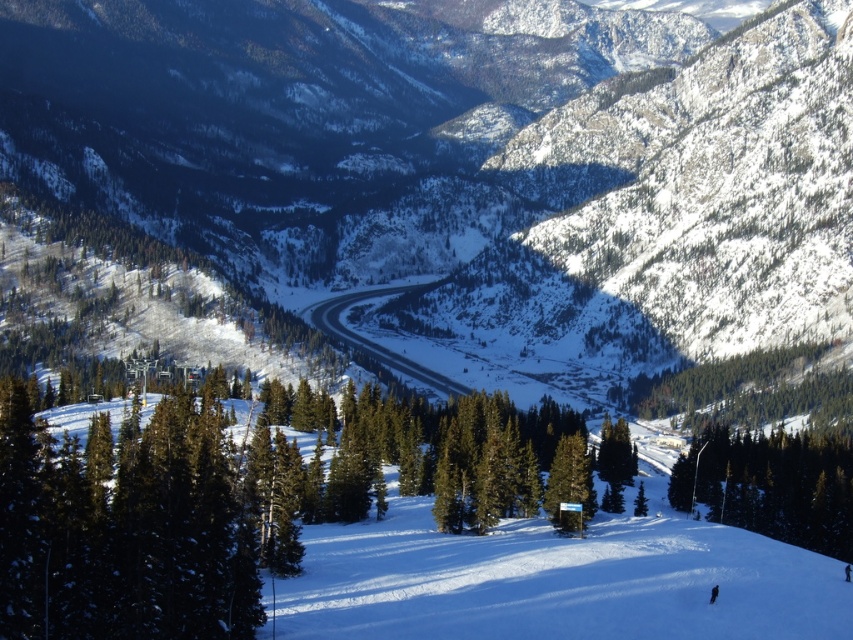
Question: Can you confirm if green textured tree at lower right is positioned to the right of green matte sign at center?

Choices:
 (A) yes
 (B) no

Answer: (A)

Question: Can you confirm if snowy forested mountain at center is smaller than green matte sign at center?

Choices:
 (A) no
 (B) yes

Answer: (A)

Question: Considering the real-world distances, which object is farthest from the green matte sign at center?

Choices:
 (A) green textured tree at lower right
 (B) snowy forested mountain at center

Answer: (B)

Question: Which point is farther to the camera?

Choices:
 (A) (112, 81)
 (B) (573, 467)
 (C) (833, 442)

Answer: (A)

Question: Which point is closer to the camera taking this photo?

Choices:
 (A) (844, 1)
 (B) (848, 452)
 (C) (570, 513)

Answer: (C)

Question: Does snowy forested mountain at center appear over green textured tree at lower right?

Choices:
 (A) yes
 (B) no

Answer: (A)